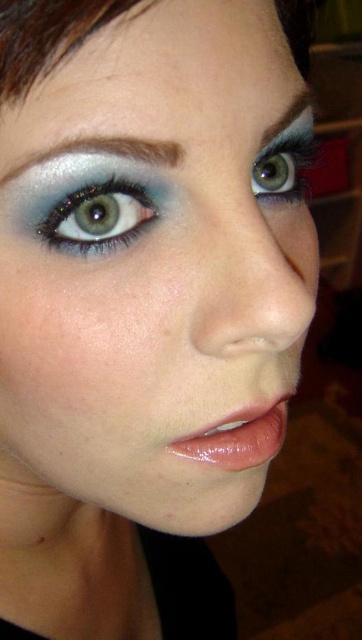
You are a makeup artist analyzing the face in the image. You need to apply a new highlighter to the area between the smokey gray eyebrow at upper left and the shiny blue eye at upper right. Based on their positions, where should you place the highlighter?

The smokey gray eyebrow at upper left is located below the shiny blue eye at upper right, so the highlighter should be applied between them, which would be above the smokey gray eyebrow at upper left and below the shiny blue eye at upper right.

You are a photographer adjusting the focus on a camera lens. You need to focus on two points on the person in the image, namely point (66, 236) and point (13, 170). Which point should you focus on first to ensure proper depth of field?

Point (66, 236) should be focused on first because it is closer to the viewer than point (13, 170). This ensures the foreground element is in focus before adjusting for the background.